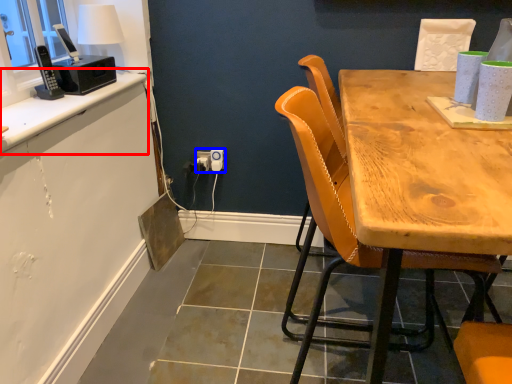
Question: Which object appears closest to the camera in this image, counter top (highlighted by a red box) or electric outlet (highlighted by a blue box)?

Choices:
 (A) counter top
 (B) electric outlet

Answer: (A)